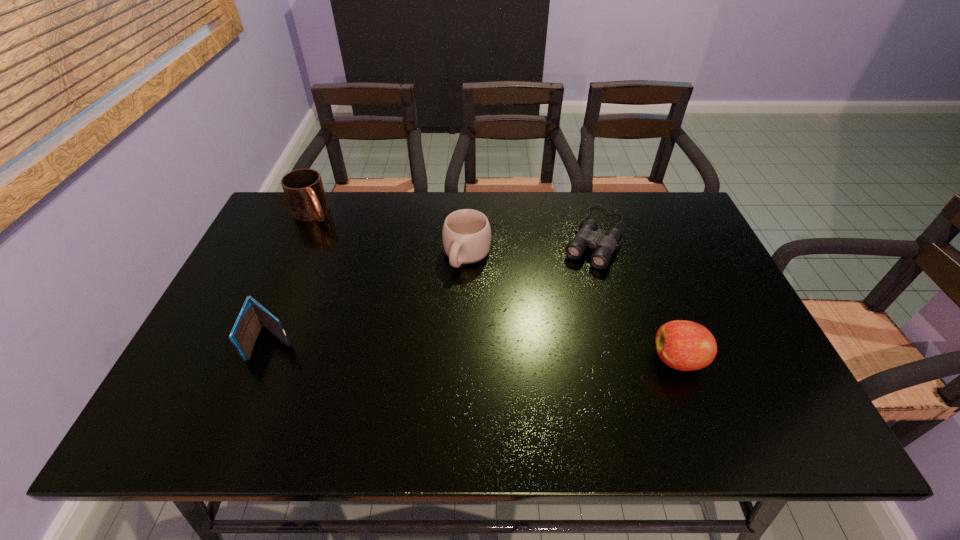
Identify the location of free spot on the desktop that is between the wallet and the apple and is positioned on the side of the farther mug with the handle. [417, 348].

The width and height of the screenshot is (960, 540). I want to click on vacant space on the desktop that is between the wallet and the apple and is positioned on the side of the nearer mug with the handle, so click(414, 348).

Locate an element on the screen. The image size is (960, 540). free spot on the desktop that is between the wallet and the apple and is positioned at the eyepiece of the binoculars is located at coordinates (522, 353).